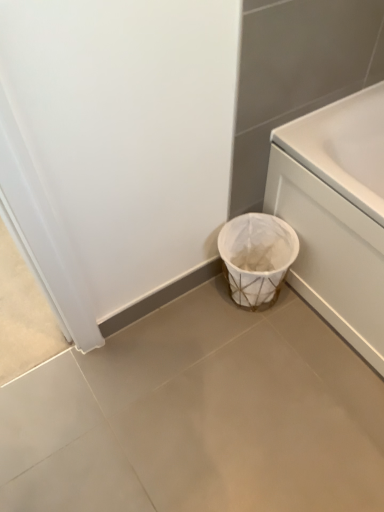
Question: Can you confirm if white glossy bathtub at right is bigger than white woven basket at lower center?

Choices:
 (A) no
 (B) yes

Answer: (B)

Question: Is white glossy bathtub at right thinner than white woven basket at lower center?

Choices:
 (A) no
 (B) yes

Answer: (A)

Question: Is white glossy bathtub at right outside white woven basket at lower center?

Choices:
 (A) yes
 (B) no

Answer: (A)

Question: Is the position of white glossy bathtub at right more distant than that of white woven basket at lower center?

Choices:
 (A) no
 (B) yes

Answer: (A)

Question: Is white glossy bathtub at right facing away from white woven basket at lower center?

Choices:
 (A) no
 (B) yes

Answer: (A)

Question: From a real-world perspective, relative to white glossy bathtub at right, is white matte trash can at lower right vertically above or below?

Choices:
 (A) above
 (B) below

Answer: (B)

Question: Is white matte trash can at lower right inside the boundaries of white glossy bathtub at right, or outside?

Choices:
 (A) inside
 (B) outside

Answer: (B)

Question: Does point (291, 308) appear closer or farther from the camera than point (304, 176)?

Choices:
 (A) closer
 (B) farther

Answer: (B)

Question: Visually, is white matte trash can at lower right positioned to the left or to the right of white glossy bathtub at right?

Choices:
 (A) left
 (B) right

Answer: (A)

Question: Looking at the image, does white glossy bathtub at right seem bigger or smaller compared to white matte trash can at lower right?

Choices:
 (A) small
 (B) big

Answer: (B)

Question: Do you think white glossy bathtub at right is within white matte trash can at lower right, or outside of it?

Choices:
 (A) inside
 (B) outside

Answer: (B)

Question: Is white glossy bathtub at right in front of or behind white matte trash can at lower right in the image?

Choices:
 (A) behind
 (B) front

Answer: (A)

Question: In the image, is white glossy bathtub at right on the left side or the right side of white matte trash can at lower right?

Choices:
 (A) left
 (B) right

Answer: (B)

Question: From their relative heights in the image, would you say white woven basket at lower center is taller or shorter than white matte trash can at lower right?

Choices:
 (A) short
 (B) tall

Answer: (B)

Question: Is white woven basket at lower center to the left or to the right of white matte trash can at lower right in the image?

Choices:
 (A) left
 (B) right

Answer: (B)